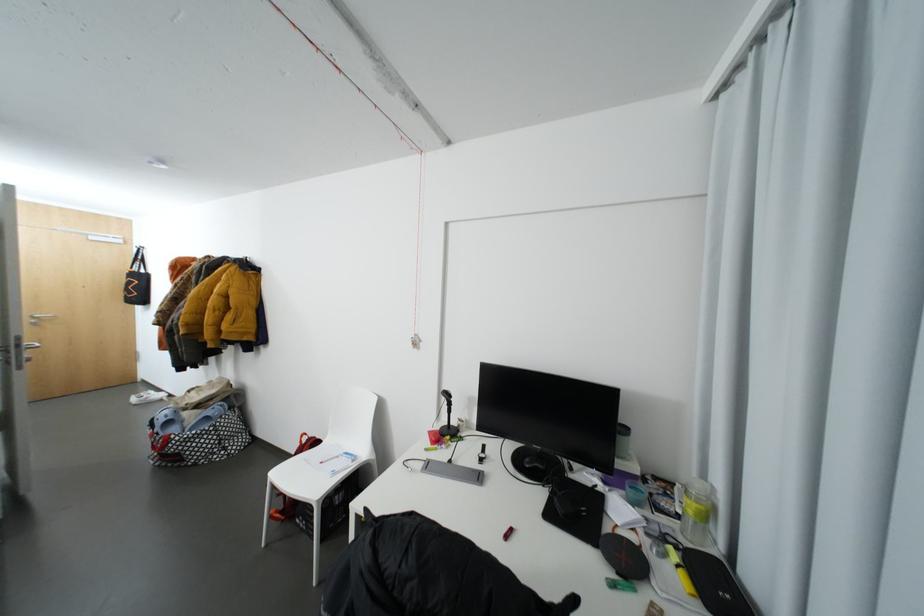
Image resolution: width=924 pixels, height=616 pixels. Find the location of `glass jar with lid`. glass jar with lid is located at coordinates (697, 513).